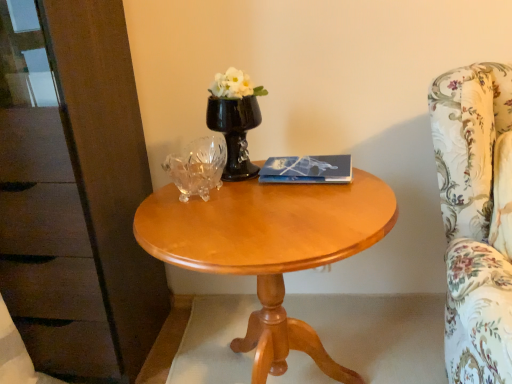
Question: From a real-world perspective, is glossy wood table at center located beneath floral fabric armchair at right?

Choices:
 (A) yes
 (B) no

Answer: (A)

Question: Is the surface of glossy wood table at center in direct contact with floral fabric armchair at right?

Choices:
 (A) no
 (B) yes

Answer: (A)

Question: From the image's perspective, does glossy wood table at center appear lower than floral fabric armchair at right?

Choices:
 (A) no
 (B) yes

Answer: (B)

Question: Is glossy wood table at center far away from floral fabric armchair at right?

Choices:
 (A) no
 (B) yes

Answer: (A)

Question: Does glossy wood table at center have a larger size compared to floral fabric armchair at right?

Choices:
 (A) no
 (B) yes

Answer: (B)

Question: Considering the positions of point (454, 102) and point (205, 258), is point (454, 102) closer or farther from the camera than point (205, 258)?

Choices:
 (A) closer
 (B) farther

Answer: (B)

Question: From the image's perspective, is floral fabric armchair at right above or below glossy wood table at center?

Choices:
 (A) below
 (B) above

Answer: (B)

Question: Would you say floral fabric armchair at right is to the left or to the right of glossy wood table at center in the picture?

Choices:
 (A) left
 (B) right

Answer: (B)

Question: Considering the positions of floral fabric armchair at right and glossy wood table at center in the image, is floral fabric armchair at right bigger or smaller than glossy wood table at center?

Choices:
 (A) small
 (B) big

Answer: (A)

Question: From the image's perspective, is floral fabric armchair at right positioned above or below black glass vase at center?

Choices:
 (A) below
 (B) above

Answer: (A)

Question: Considering the positions of floral fabric armchair at right and black glass vase at center in the image, is floral fabric armchair at right wider or thinner than black glass vase at center?

Choices:
 (A) thin
 (B) wide

Answer: (B)

Question: In terms of size, does floral fabric armchair at right appear bigger or smaller than black glass vase at center?

Choices:
 (A) big
 (B) small

Answer: (A)

Question: From a real-world perspective, is floral fabric armchair at right above or below black glass vase at center?

Choices:
 (A) below
 (B) above

Answer: (A)

Question: Is point (245, 251) positioned closer to the camera than point (342, 178)?

Choices:
 (A) farther
 (B) closer

Answer: (B)

Question: Relative to blue glossy book at center, is glossy wood table at center in front or behind?

Choices:
 (A) behind
 (B) front

Answer: (B)